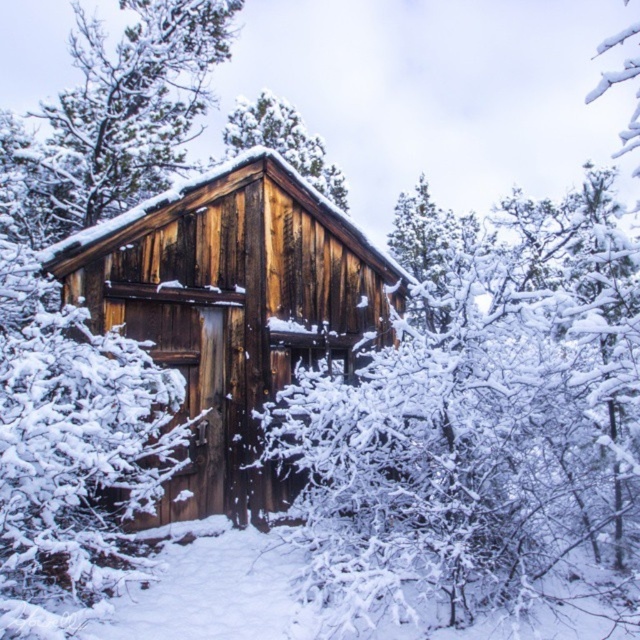
You are standing in front of the rustic wooden cabin and want to determine the position of two points marked in the scene. Which point is closer to you, point (64, 250) or point (230, 145)?

Point (64, 250) is closer to the viewer than point (230, 145).